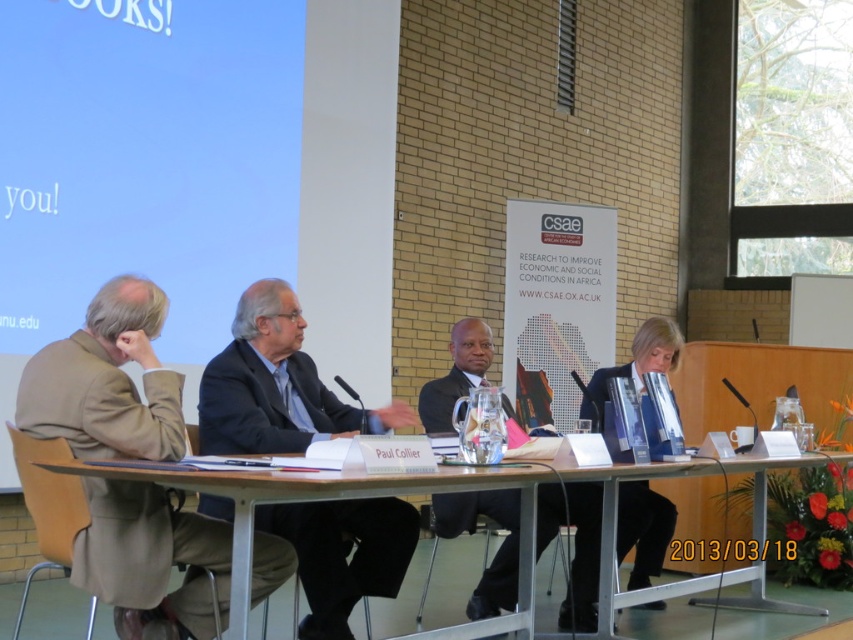
Is brown woolen jacket at left to the right of clear plastic table at center from the viewer's perspective?

In fact, brown woolen jacket at left is to the left of clear plastic table at center.

Can you confirm if brown woolen jacket at left is wider than clear plastic table at center?

No.

Is point (93, 484) positioned behind point (236, 572)?

Yes, point (93, 484) is behind point (236, 572).

The image size is (853, 640). In order to click on brown woolen jacket at left in this screenshot , I will do `click(107, 381)`.

Does clear plastic table at center have a greater width compared to blue fabric jacket at center?

Indeed, clear plastic table at center has a greater width compared to blue fabric jacket at center.

Does point (485, 481) lie in front of point (671, 515)?

Yes, it is in front of point (671, 515).

Locate an element on the screen. The height and width of the screenshot is (640, 853). clear plastic table at center is located at coordinates (520, 524).

Does brown woolen jacket at left appear on the left side of blue fabric jacket at center?

Yes, brown woolen jacket at left is to the left of blue fabric jacket at center.

Between brown woolen jacket at left and blue fabric jacket at center, which one is positioned lower?

Positioned lower is brown woolen jacket at left.

This screenshot has height=640, width=853. Find the location of `brown woolen jacket at left`. brown woolen jacket at left is located at coordinates (107, 381).